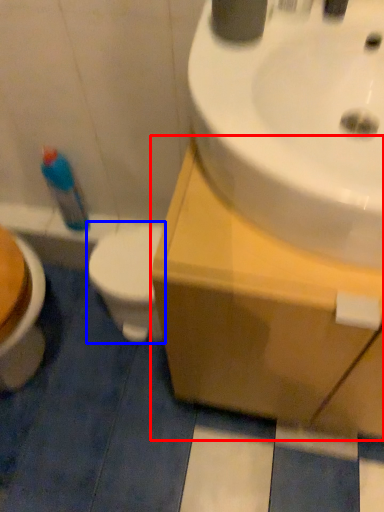
Question: Which point is further to the camera, counter top (highlighted by a red box) or toilet (highlighted by a blue box)?

Choices:
 (A) counter top
 (B) toilet

Answer: (B)